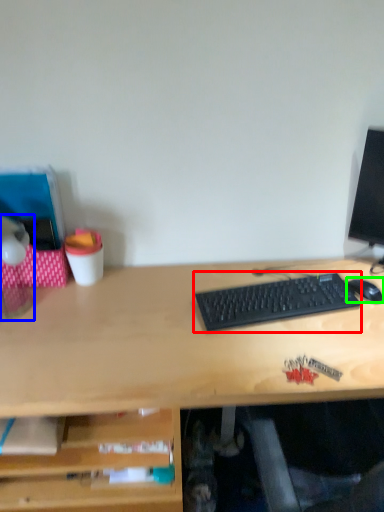
Question: Which is farther away from computer keyboard (highlighted by a red box)? table lamp (highlighted by a blue box) or mouse (highlighted by a green box)?

Choices:
 (A) table lamp
 (B) mouse

Answer: (A)